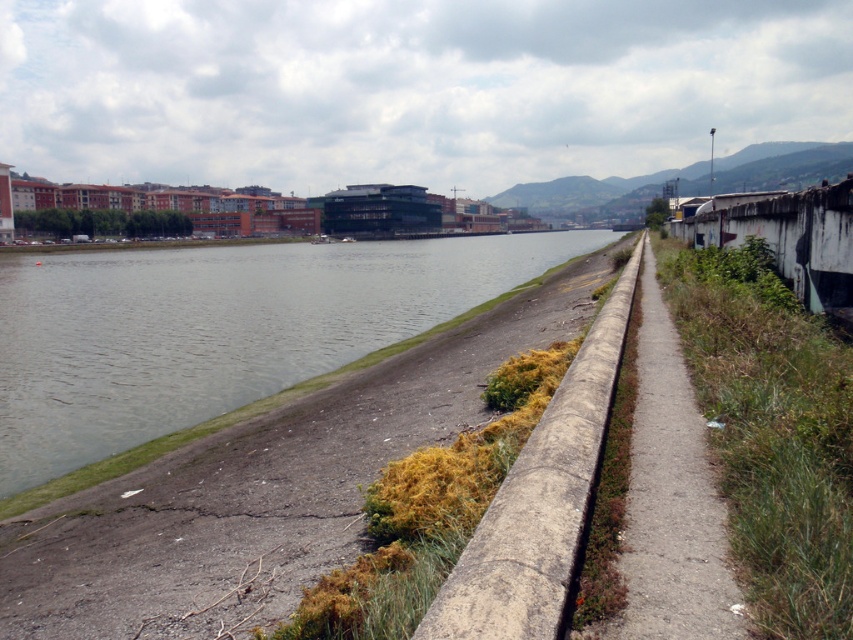
Between green concrete river at center and concrete at right, which one has more height?

Standing taller between the two is green concrete river at center.

Is green concrete river at center below concrete at right?

Actually, green concrete river at center is above concrete at right.

Who is more distant from viewer, (186, 362) or (669, 465)?

The point (186, 362) is behind.

The height and width of the screenshot is (640, 853). What are the coordinates of `green concrete river at center` in the screenshot? It's located at click(x=215, y=330).

Is concrete at right thinner than concrete at center?

Yes, concrete at right is thinner than concrete at center.

You are a GUI agent. You are given a task and a screenshot of the screen. Output one action in this format:
    pyautogui.click(x=<x>, y=<y>)
    Task: Click on the concrete at right
    The image size is (853, 640).
    Given the screenshot: What is the action you would take?
    pyautogui.click(x=666, y=496)

Locate an element on the screen. The height and width of the screenshot is (640, 853). concrete at right is located at coordinates (666, 496).

Is green concrete river at center smaller than concrete at center?

No, green concrete river at center is not smaller than concrete at center.

The height and width of the screenshot is (640, 853). I want to click on green concrete river at center, so click(215, 330).

This screenshot has width=853, height=640. Identify the location of green concrete river at center. (215, 330).